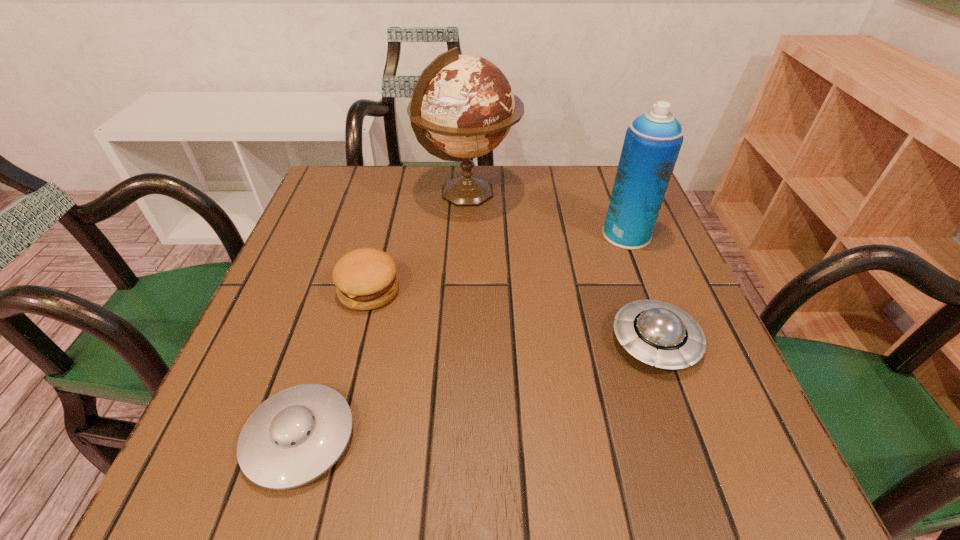
Locate an element on the screen. The height and width of the screenshot is (540, 960). vacant space that's between the third shortest object and the third object from left to right is located at coordinates (419, 242).

At what (x,y) coordinates should I click in order to perform the action: click on empty location between the fourth tallest object and the globe. Please return your answer as a coordinate pair (x, y). This screenshot has height=540, width=960. Looking at the image, I should click on (562, 267).

In order to click on vacant area between the second shortest object and the second tallest object in this screenshot , I will do `click(640, 288)`.

Find the location of `free space between the second tallest object and the globe`. free space between the second tallest object and the globe is located at coordinates (547, 214).

Identify which object is the nearest to the second shortest object. Please provide its 2D coordinates. Your answer should be formatted as a tuple, i.e. [(x, y)], where the tuple contains the x and y coordinates of a point satisfying the conditions above.

[(652, 143)]

Image resolution: width=960 pixels, height=540 pixels. In order to click on object that is the fourth closest to the third object from right to left in this screenshot , I will do [296, 435].

The image size is (960, 540). In order to click on vacant position in the image that satisfies the following two spatial constraints: 1. on the front of the fourth tallest object showing Asia; 2. on the left side of the globe in this screenshot , I will do `click(463, 341)`.

I want to click on free space that satisfies the following two spatial constraints: 1. on the front of the globe showing Asia; 2. on the back side of the aerosol can, so click(467, 234).

At what (x,y) coordinates should I click in order to perform the action: click on vacant space that satisfies the following two spatial constraints: 1. on the back side of the second tallest object; 2. on the right side of the right saucer. Please return your answer as a coordinate pair (x, y). Looking at the image, I should click on (617, 234).

This screenshot has height=540, width=960. Identify the location of vacant area in the image that satisfies the following two spatial constraints: 1. on the back side of the nearest object; 2. on the left side of the fourth shortest object. (362, 234).